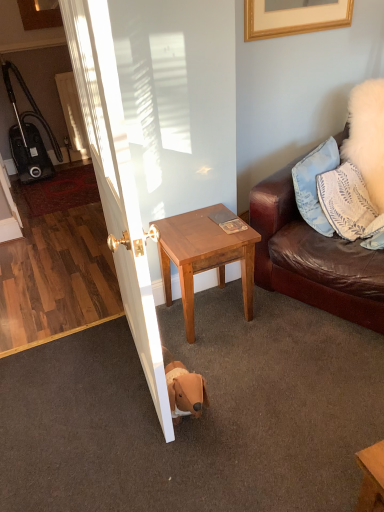
Where is `vacant area situated below light brown wood side table at center (from a real-world perspective)`? The image size is (384, 512). vacant area situated below light brown wood side table at center (from a real-world perspective) is located at coordinates (223, 306).